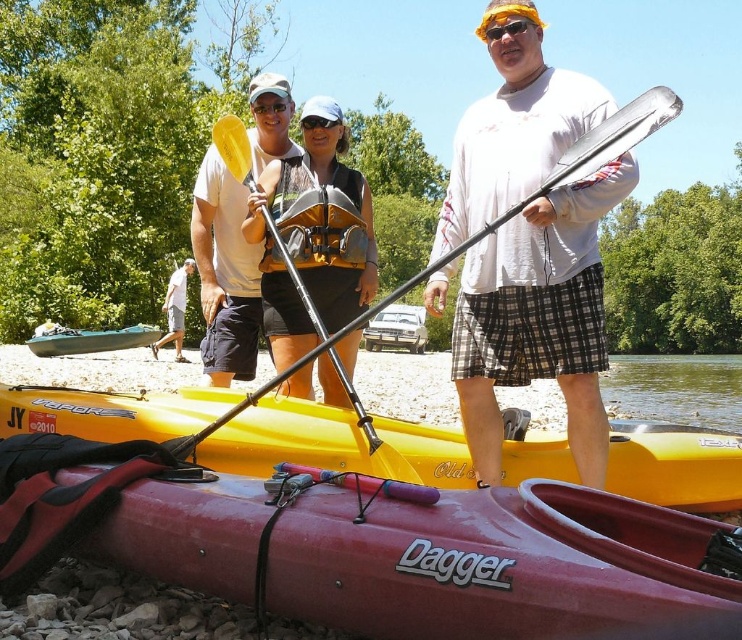
Question: Does maroon rubber kayak at center come in front of matte yellow sunglasses at center?

Choices:
 (A) yes
 (B) no

Answer: (B)

Question: Is the position of maroon rubber kayak at center more distant than that of teal plastic kayak at lower left?

Choices:
 (A) no
 (B) yes

Answer: (A)

Question: From the image, what is the correct spatial relationship of maroon rubber kayak at center in relation to yellow plastic paddle at center?

Choices:
 (A) above
 (B) below

Answer: (B)

Question: Which point appears closest to the camera in this image?

Choices:
 (A) (462, 202)
 (B) (441, 547)
 (C) (252, 227)
 (D) (315, 122)

Answer: (B)

Question: Which object appears farthest from the camera in this image?

Choices:
 (A) black matte goggles at center
 (B) matte yellow sunglasses at center

Answer: (A)

Question: Which of the following is the farthest from the observer?

Choices:
 (A) (68, 337)
 (B) (223, 147)

Answer: (A)